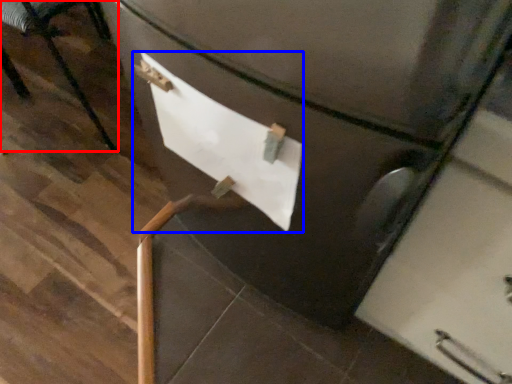
Question: Which object is further to the camera taking this photo, furniture (highlighted by a red box) or paper (highlighted by a blue box)?

Choices:
 (A) furniture
 (B) paper

Answer: (A)